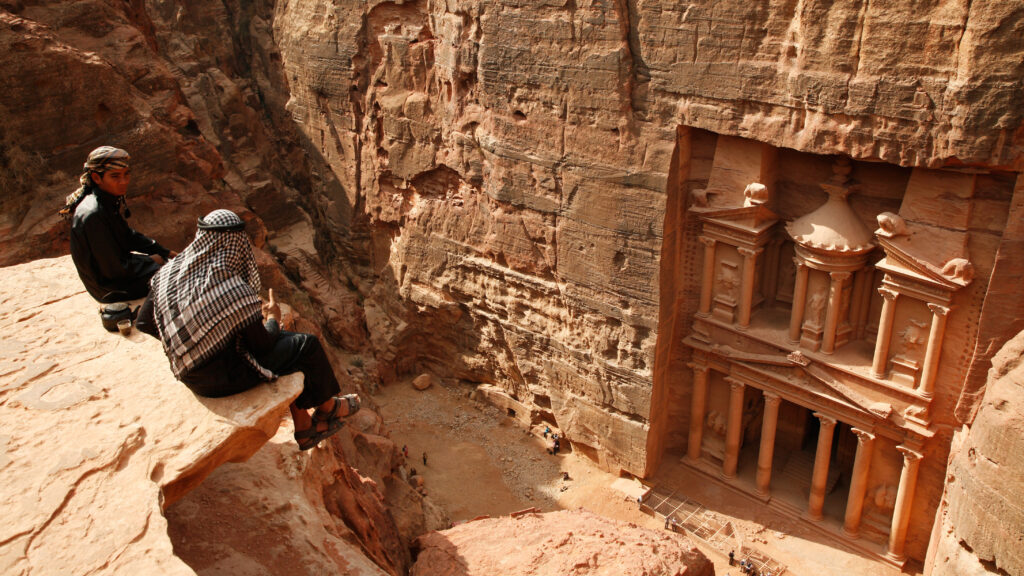
Locate an element on the screen. The height and width of the screenshot is (576, 1024). teapot is located at coordinates (102, 306).